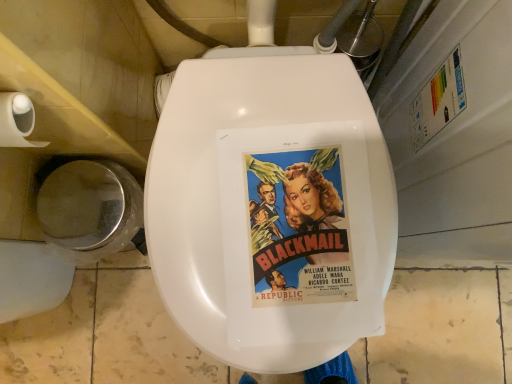
At what (x,y) coordinates should I click in order to perform the action: click on vivid paper movie poster at center. Please return your answer as a coordinate pair (x, y). This screenshot has height=384, width=512. Looking at the image, I should click on [x=298, y=228].

The width and height of the screenshot is (512, 384). Describe the element at coordinates (89, 210) in the screenshot. I see `shiny metallic toilet bowl at lower left` at that location.

The width and height of the screenshot is (512, 384). Find the location of `vivid paper movie poster at center`. vivid paper movie poster at center is located at coordinates (298, 228).

Can you tell me how much vivid paper movie poster at center and white matte toilet paper at left differ in facing direction?

The angular difference between vivid paper movie poster at center and white matte toilet paper at left is 4.77 degrees.

Can you confirm if vivid paper movie poster at center is shorter than white matte toilet paper at left?

Yes, vivid paper movie poster at center is shorter than white matte toilet paper at left.

Who is bigger, vivid paper movie poster at center or white matte toilet paper at left?

white matte toilet paper at left.

Is vivid paper movie poster at center situated inside shiny metallic toilet bowl at lower left or outside?

vivid paper movie poster at center is spatially situated outside shiny metallic toilet bowl at lower left.

Which is behind, vivid paper movie poster at center or shiny metallic toilet bowl at lower left?

shiny metallic toilet bowl at lower left is further away from the camera.

From a real-world perspective, which is physically above, vivid paper movie poster at center or shiny metallic toilet bowl at lower left?

vivid paper movie poster at center.

From the image's perspective, is vivid paper movie poster at center beneath shiny metallic toilet bowl at lower left?

Yes, from the image's perspective, vivid paper movie poster at center is below shiny metallic toilet bowl at lower left.

Based on the photo, can you tell me how much shiny metallic toilet bowl at lower left and white matte toilet paper at left differ in facing direction?

1.37 degrees separate the facing orientations of shiny metallic toilet bowl at lower left and white matte toilet paper at left.

From a real-world perspective, relative to white matte toilet paper at left, is shiny metallic toilet bowl at lower left vertically above or below?

In terms of real-world spatial position, shiny metallic toilet bowl at lower left is below white matte toilet paper at left.

Looking at their sizes, would you say shiny metallic toilet bowl at lower left is wider or thinner than white matte toilet paper at left?

Considering their sizes, shiny metallic toilet bowl at lower left looks broader than white matte toilet paper at left.

From the image's perspective, is shiny metallic toilet bowl at lower left below white matte toilet paper at left?

Correct, shiny metallic toilet bowl at lower left appears lower than white matte toilet paper at left in the image.

How far apart are white matte toilet paper at left and vivid paper movie poster at center?

The distance of white matte toilet paper at left from vivid paper movie poster at center is 35.57 centimeters.

Who is bigger, white matte toilet paper at left or vivid paper movie poster at center?

white matte toilet paper at left is bigger.

From the image's perspective, between white matte toilet paper at left and vivid paper movie poster at center, which one is located above?

white matte toilet paper at left appears higher in the image.

Considering their positions, is white matte toilet paper at left located in front of or behind vivid paper movie poster at center?

In the image, white matte toilet paper at left appears in front of vivid paper movie poster at center.

Considering the sizes of shiny metallic toilet bowl at lower left and vivid paper movie poster at center in the image, is shiny metallic toilet bowl at lower left wider or thinner than vivid paper movie poster at center?

Clearly, shiny metallic toilet bowl at lower left has less width compared to vivid paper movie poster at center.

Could you tell me if shiny metallic toilet bowl at lower left is facing vivid paper movie poster at center?

No, shiny metallic toilet bowl at lower left is not turned towards vivid paper movie poster at center.

Is shiny metallic toilet bowl at lower left not near vivid paper movie poster at center?

Actually, shiny metallic toilet bowl at lower left and vivid paper movie poster at center are a little close together.

Does shiny metallic toilet bowl at lower left have a smaller size compared to vivid paper movie poster at center?

Incorrect, shiny metallic toilet bowl at lower left is not smaller in size than vivid paper movie poster at center.

Is white matte toilet paper at left positioned beyond the bounds of shiny metallic toilet bowl at lower left?

Yes, white matte toilet paper at left is located beyond the bounds of shiny metallic toilet bowl at lower left.

From the image's perspective, is white matte toilet paper at left located above shiny metallic toilet bowl at lower left?

Yes.

Can you tell me how much white matte toilet paper at left and shiny metallic toilet bowl at lower left differ in facing direction?

1.37 degrees.

Considering the relative sizes of white matte toilet paper at left and shiny metallic toilet bowl at lower left in the image provided, is white matte toilet paper at left bigger than shiny metallic toilet bowl at lower left?

No, white matte toilet paper at left is not bigger than shiny metallic toilet bowl at lower left.

This screenshot has width=512, height=384. Find the location of `movie poster beneath the white matte toilet paper at left (from a real-world perspective)`. movie poster beneath the white matte toilet paper at left (from a real-world perspective) is located at coordinates (298, 228).

At what (x,y) coordinates should I click in order to perform the action: click on toilet bowl above the vivid paper movie poster at center (from the image's perspective). Please return your answer as a coordinate pair (x, y). The width and height of the screenshot is (512, 384). Looking at the image, I should click on (89, 210).

Looking at the image, which one is located closer to shiny metallic toilet bowl at lower left, vivid paper movie poster at center or white matte toilet paper at left?

white matte toilet paper at left.

When comparing their distances from vivid paper movie poster at center, does shiny metallic toilet bowl at lower left or white matte toilet paper at left seem further?

shiny metallic toilet bowl at lower left is positioned further to the anchor vivid paper movie poster at center.

Considering their positions, is shiny metallic toilet bowl at lower left positioned further to white matte toilet paper at left than vivid paper movie poster at center?

vivid paper movie poster at center is further to white matte toilet paper at left.

Which object lies further to the anchor point shiny metallic toilet bowl at lower left, white matte toilet paper at left or vivid paper movie poster at center?

vivid paper movie poster at center is further to shiny metallic toilet bowl at lower left.

In the scene shown: Based on their spatial positions, is vivid paper movie poster at center or shiny metallic toilet bowl at lower left further from white matte toilet paper at left?

vivid paper movie poster at center.

Looking at the image, which one is located further to vivid paper movie poster at center, white matte toilet paper at left or shiny metallic toilet bowl at lower left?

Based on the image, shiny metallic toilet bowl at lower left appears to be further to vivid paper movie poster at center.

In order to click on toilet paper situated between shiny metallic toilet bowl at lower left and vivid paper movie poster at center from left to right in this screenshot , I will do `click(17, 121)`.